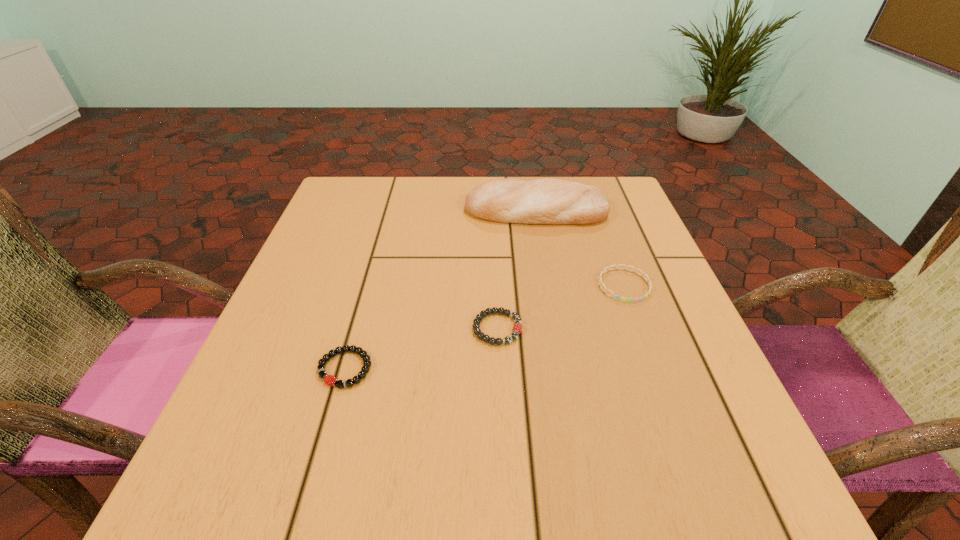
Identify the location of vacant space located 0.220m on the surface of the second farthest object showing star-shaped elements. The image size is (960, 540). (667, 404).

Locate an element on the screen. Image resolution: width=960 pixels, height=540 pixels. vacant space situated 0.400m on the right of the nearest bracelet is located at coordinates (615, 369).

Locate an element on the screen. The height and width of the screenshot is (540, 960). object that is at the far edge is located at coordinates (547, 201).

Identify the location of object at the left edge. (330, 380).

Identify the location of bread that is at the right edge. This screenshot has height=540, width=960. [x=547, y=201].

Locate an element on the screen. The width and height of the screenshot is (960, 540). bracelet that is positioned at the right edge is located at coordinates (x=600, y=283).

The height and width of the screenshot is (540, 960). In order to click on object at the far right corner in this screenshot , I will do `click(547, 201)`.

In the image, there is a desktop. Where is `free space at the far edge`? free space at the far edge is located at coordinates (447, 190).

The image size is (960, 540). What are the coordinates of `free region at the near edge of the desktop` in the screenshot? It's located at (350, 494).

In the image, there is a desktop. At what (x,y) coordinates should I click in order to perform the action: click on vacant space at the left edge. Please return your answer as a coordinate pair (x, y). This screenshot has width=960, height=540. Looking at the image, I should click on pyautogui.click(x=326, y=276).